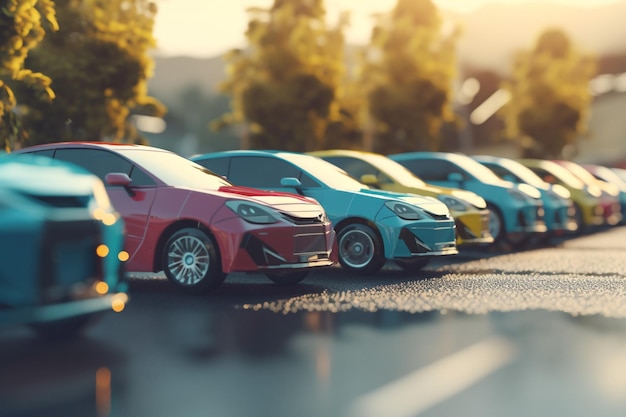
Locate an element on the screen. This screenshot has width=626, height=417. window is located at coordinates tap(39, 152), tap(88, 158), tap(133, 177), tap(217, 161), tap(255, 173), tap(309, 181), tap(356, 162), tap(424, 167), tap(498, 173), tap(546, 177).